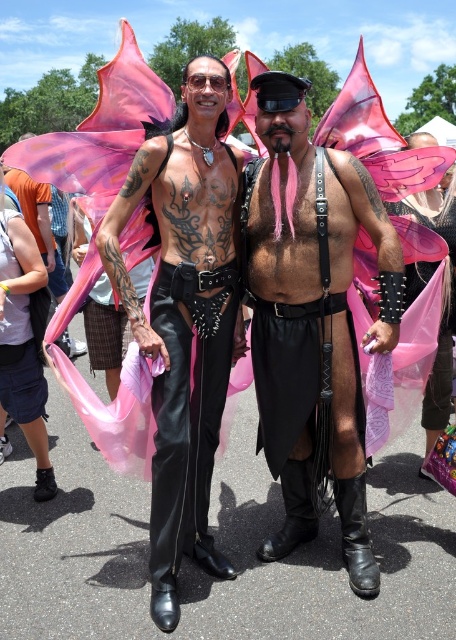
Question: Can you confirm if leather pants at center is smaller than matte black leather pants at center?

Choices:
 (A) no
 (B) yes

Answer: (A)

Question: Does matte black leather vest at center appear on the right side of leather pants at center?

Choices:
 (A) no
 (B) yes

Answer: (B)

Question: Considering the real-world distances, which object is closest to the leather pants at center?

Choices:
 (A) matte black leather vest at center
 (B) matte black leather pants at center

Answer: (A)

Question: Based on their relative distances, which object is farther from the matte black leather pants at center?

Choices:
 (A) leather pants at center
 (B) matte black leather vest at center

Answer: (B)

Question: Considering the real-world distances, which object is closest to the matte black leather pants at center?

Choices:
 (A) leather pants at center
 (B) matte black leather vest at center

Answer: (A)

Question: Is matte black leather vest at center smaller than leather pants at center?

Choices:
 (A) yes
 (B) no

Answer: (B)